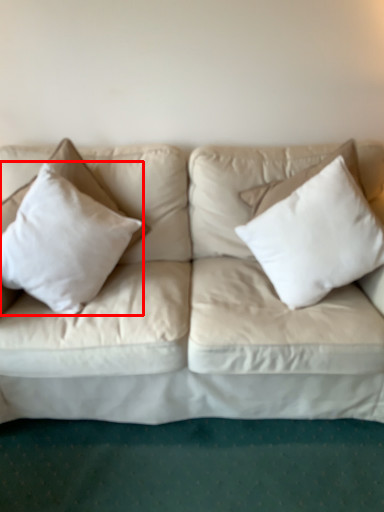
Question: From the image's perspective, what is the correct spatial positioning of pillow (annotated by the red box) in reference to pillow?

Choices:
 (A) below
 (B) above

Answer: (A)